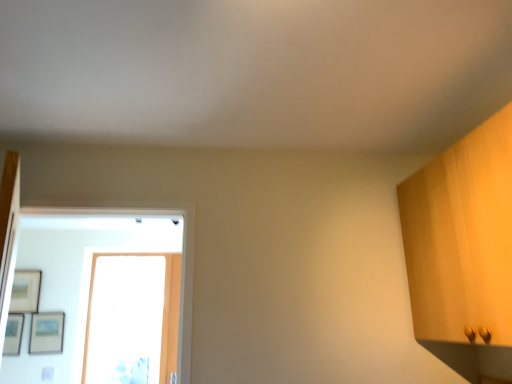
Question: In terms of size, does transparent glass door at center appear bigger or smaller than matte black picture frame at lower left, the first picture frame when ordered from right to left?

Choices:
 (A) big
 (B) small

Answer: (A)

Question: Based on their positions, is transparent glass door at center located to the left or right of matte black picture frame at lower left, marked as the 3th picture frame in a left-to-right arrangement?

Choices:
 (A) left
 (B) right

Answer: (B)

Question: Which of these objects is positioned farthest from the transparent glass door at center?

Choices:
 (A) matte black picture frame at left, which is counted as the 2th picture frame, starting from the right
 (B) matte black picture frame at lower left, marked as the 3th picture frame in a left-to-right arrangement
 (C) matte wooden picture frame at upper left, which is counted as the third picture frame, starting from the right

Answer: (A)

Question: Which object is positioned farthest from the matte wooden picture frame at upper left, which is counted as the third picture frame, starting from the right?

Choices:
 (A) transparent glass door at center
 (B) matte black picture frame at lower left, the first picture frame when ordered from right to left
 (C) matte black picture frame at left, marked as the second picture frame in a left-to-right arrangement

Answer: (A)